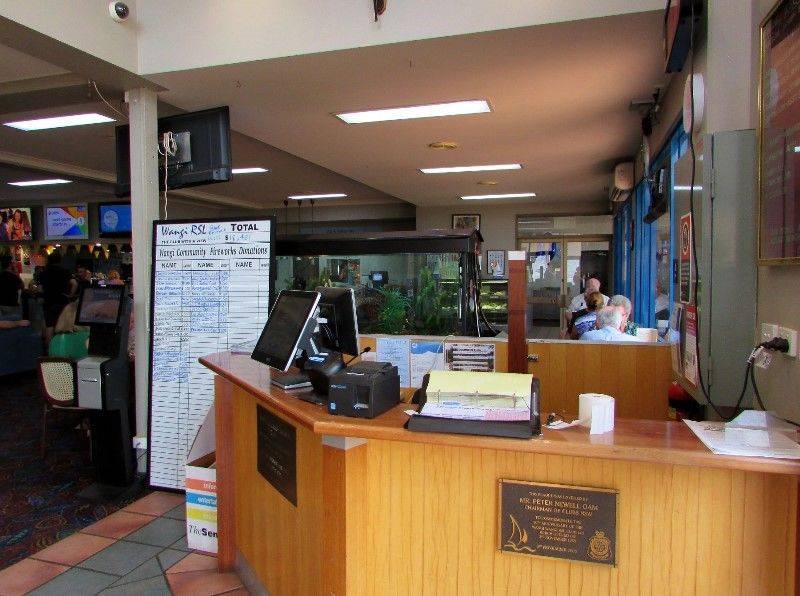
Identify the location of wooden countertop. (641, 447).